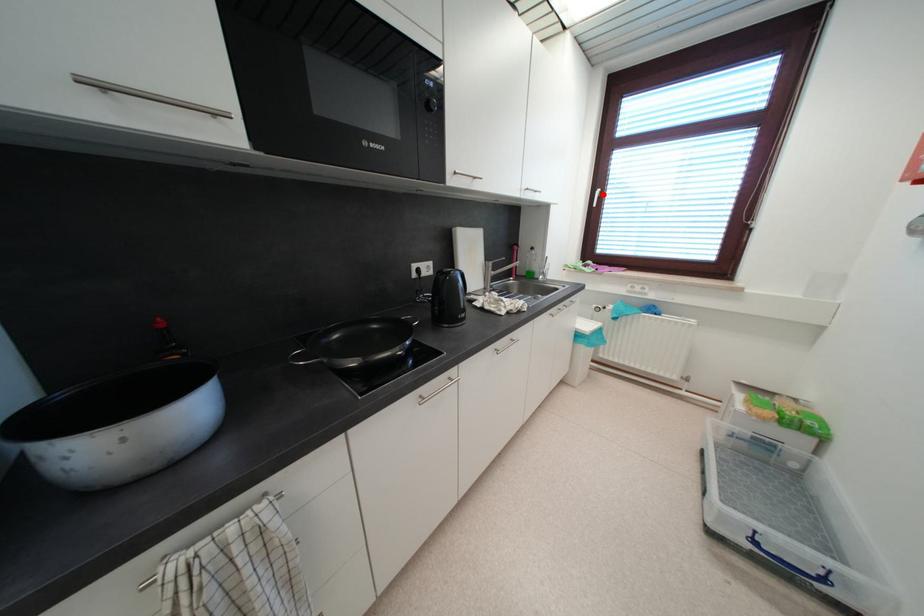
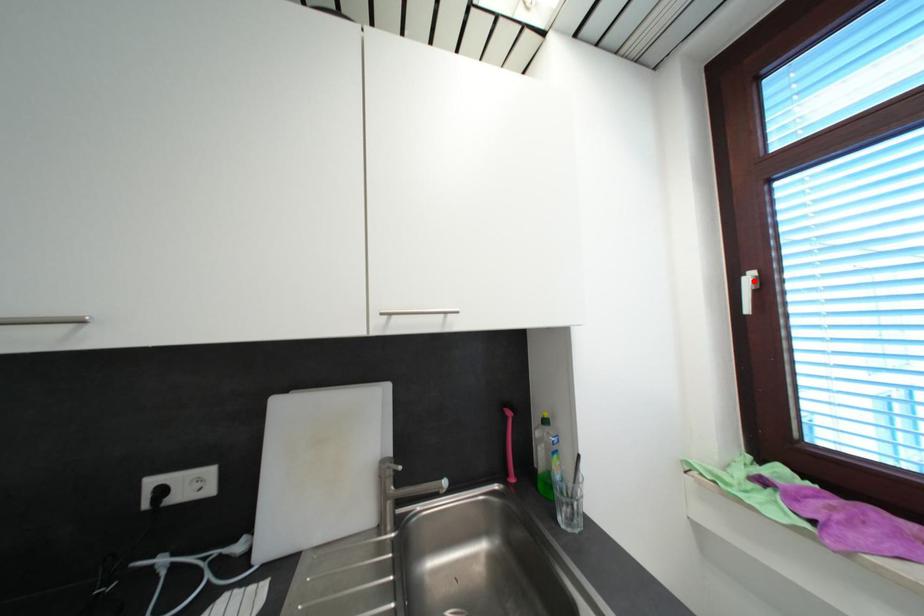
Looking at this image, I am providing you with two images of the same scene from different viewpoints. A red point is marked on the first image and another point is marked on the second image. Is the red point in image1 aligned with the point shown in image2?

Yes